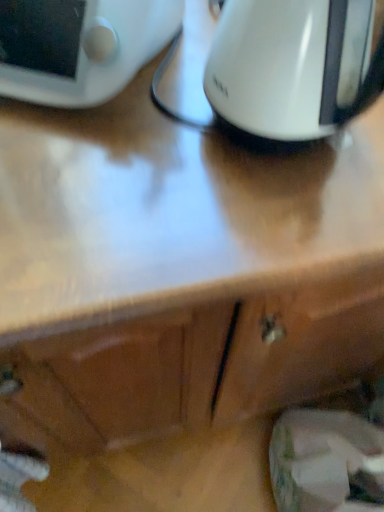
Question: From a real-world perspective, is white glossy kettle at upper center above or below white glossy digital clock at upper left?

Choices:
 (A) below
 (B) above

Answer: (B)

Question: Looking at the image, does white glossy kettle at upper center seem bigger or smaller compared to white glossy digital clock at upper left?

Choices:
 (A) small
 (B) big

Answer: (A)

Question: From the image's perspective, is white glossy kettle at upper center located above or below white glossy digital clock at upper left?

Choices:
 (A) below
 (B) above

Answer: (A)

Question: From a real-world perspective, is white glossy digital clock at upper left physically located above or below white glossy kettle at upper center?

Choices:
 (A) below
 (B) above

Answer: (A)

Question: Considering their positions, is white glossy digital clock at upper left located in front of or behind white glossy kettle at upper center?

Choices:
 (A) behind
 (B) front

Answer: (A)

Question: Considering the positions of white glossy digital clock at upper left and white glossy kettle at upper center in the image, is white glossy digital clock at upper left taller or shorter than white glossy kettle at upper center?

Choices:
 (A) short
 (B) tall

Answer: (A)

Question: Is white glossy digital clock at upper left inside or outside of white glossy kettle at upper center?

Choices:
 (A) inside
 (B) outside

Answer: (B)